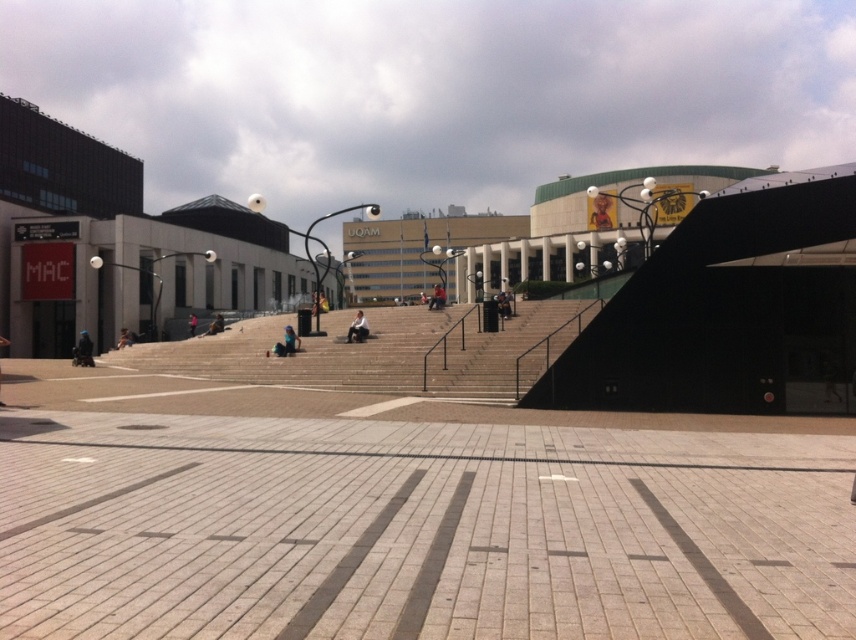
Question: Which point is closer to the camera taking this photo?

Choices:
 (A) (194, 317)
 (B) (443, 300)
 (C) (324, 308)

Answer: (B)

Question: Among these objects, which one is nearest to the camera?

Choices:
 (A) dark gray jacket at center
 (B) dark blue jeans at lower left
 (C) blue fabric person at center
 (D) brown leather jacket at center

Answer: (A)

Question: From the image, what is the correct spatial relationship of light brown leather jacket at center in relation to blue fabric person at center?

Choices:
 (A) above
 (B) below

Answer: (A)

Question: Does red fabric jacket at center come in front of blue fabric person at center?

Choices:
 (A) yes
 (B) no

Answer: (A)

Question: Which point is farther to the camera?

Choices:
 (A) (207, 326)
 (B) (437, 285)

Answer: (B)

Question: Can you confirm if dark blue jeans at center is smaller than brown leather jacket at center?

Choices:
 (A) yes
 (B) no

Answer: (B)